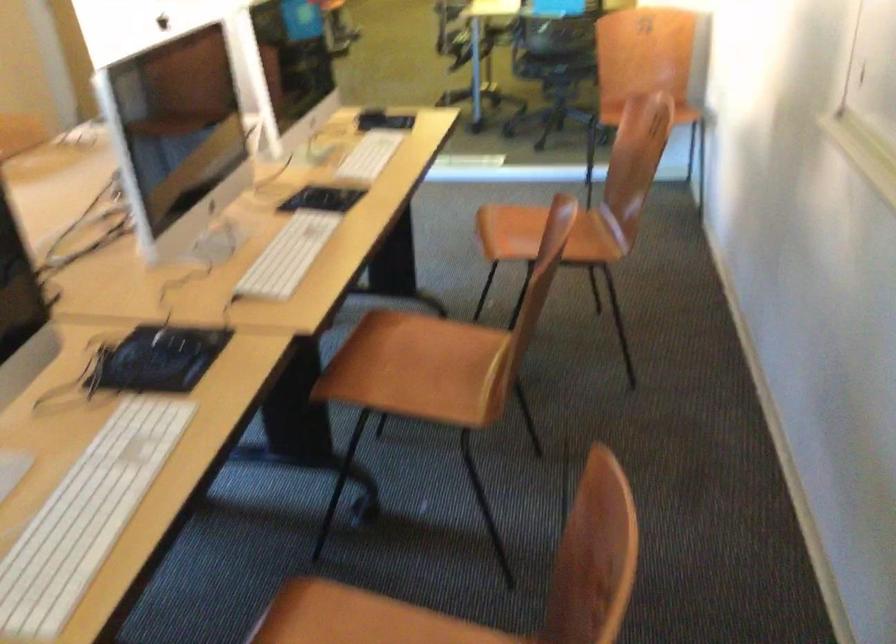
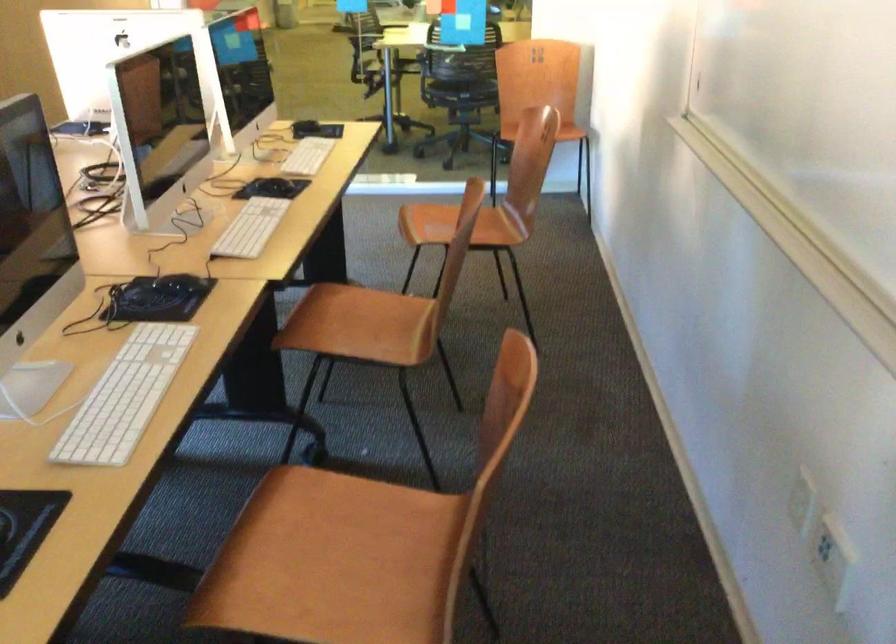
Question: What movement of the cameraman would produce the second image?

Choices:
 (A) Left
 (B) Right
 (C) Forward
 (D) Backward

Answer: (D)